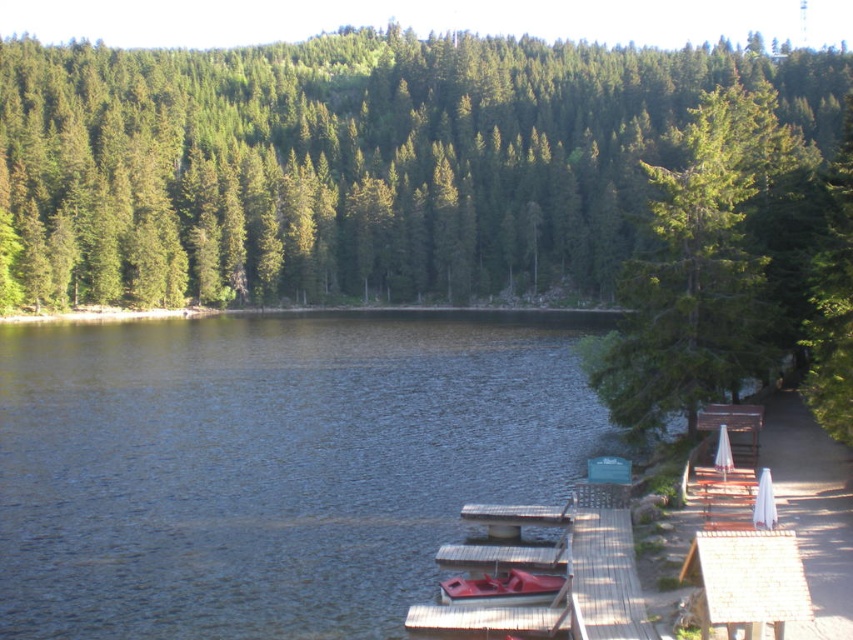
Can you confirm if blue water at lower left is thinner than rubber boat at dock center?

Incorrect, blue water at lower left's width is not less than rubber boat at dock center's.

Does blue water at lower left appear under rubber boat at dock center?

Incorrect, blue water at lower left is not positioned below rubber boat at dock center.

Image resolution: width=853 pixels, height=640 pixels. Describe the element at coordinates (270, 465) in the screenshot. I see `blue water at lower left` at that location.

You are a GUI agent. You are given a task and a screenshot of the screen. Output one action in this format:
    pyautogui.click(x=<x>, y=<y>)
    Task: Click on the blue water at lower left
    The height and width of the screenshot is (640, 853).
    Given the screenshot: What is the action you would take?
    pyautogui.click(x=270, y=465)

Is green matte tree at upper right positioned at the back of rubber boat at dock center?

Yes.

Find the location of a particular element. This screenshot has width=853, height=640. green matte tree at upper right is located at coordinates (704, 266).

Describe the element at coordinates (502, 588) in the screenshot. I see `rubber boat at dock center` at that location.

Which of these two, rubber boat at dock center or white wood picnic table at right, stands shorter?

Standing shorter between the two is rubber boat at dock center.

Between point (532, 588) and point (708, 406), which one is positioned in front?

Point (532, 588) is in front.

Image resolution: width=853 pixels, height=640 pixels. I want to click on rubber boat at dock center, so click(502, 588).